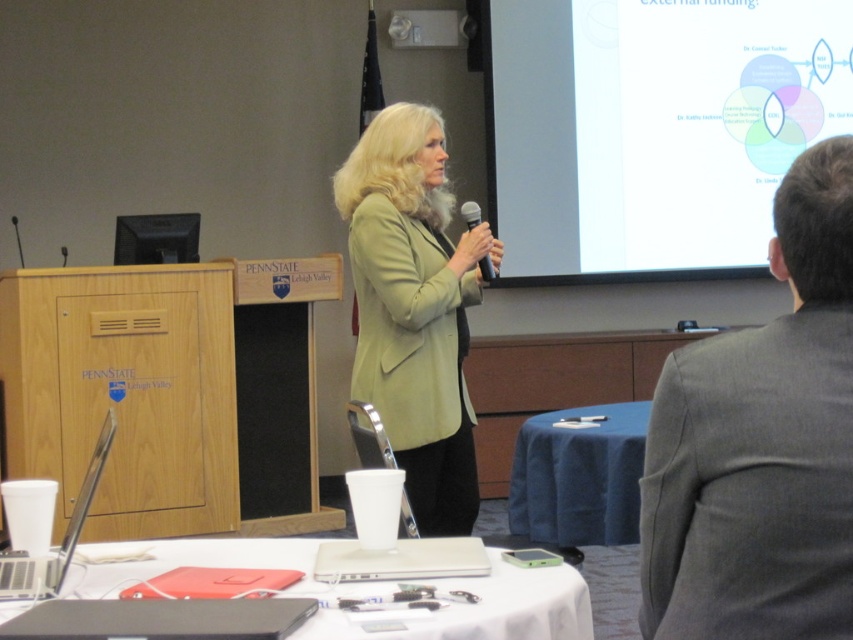
Question: Which point is closer to the camera taking this photo?

Choices:
 (A) (567, 452)
 (B) (218, 561)
 (C) (413, 353)
 (D) (479, 260)

Answer: (B)

Question: Considering the relative positions of white plastic cup at lower center and blue fabric table at center in the image provided, where is white plastic cup at lower center located with respect to blue fabric table at center?

Choices:
 (A) right
 (B) left

Answer: (B)

Question: Which of the following is the closest to the observer?

Choices:
 (A) blue fabric table at center
 (B) white plastic cup at lower center
 (C) black plastic microphone at center

Answer: (B)

Question: Estimate the real-world distances between objects in this image. Which object is farther from the white plastic cup at lower center?

Choices:
 (A) green matte blazer at center
 (B) white glossy projection screen at upper right
 (C) blue fabric table at center
 (D) gray suit at upper right

Answer: (B)

Question: Does white glossy projection screen at upper right appear on the left side of gray suit at upper right?

Choices:
 (A) yes
 (B) no

Answer: (B)

Question: Does white glossy projection screen at upper right appear over green matte blazer at center?

Choices:
 (A) no
 (B) yes

Answer: (B)